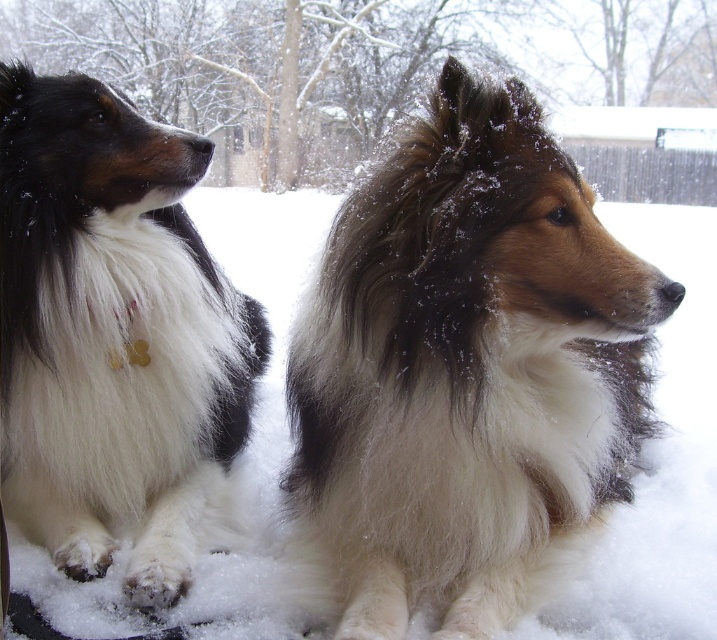
Who is lower down, fluffy white dog at center or fluffy white dog at left?

fluffy white dog at center

Between fluffy white dog at center and fluffy white dog at left, which one has less height?

With less height is fluffy white dog at center.

Identify the location of fluffy white dog at center. The height and width of the screenshot is (640, 717). (465, 371).

You are a GUI agent. You are given a task and a screenshot of the screen. Output one action in this format:
    pyautogui.click(x=<x>, y=<y>)
    Task: Click on the fluffy white dog at center
    The image size is (717, 640).
    Given the screenshot: What is the action you would take?
    pyautogui.click(x=465, y=371)